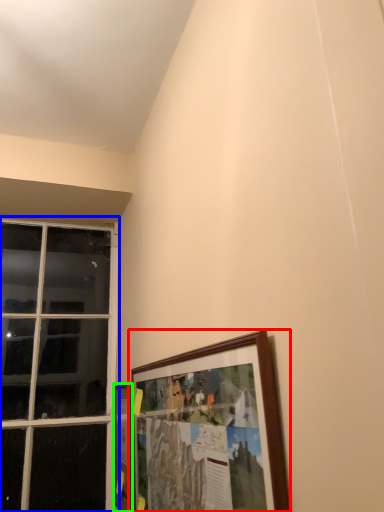
Question: Which is nearer to the picture frame (highlighted by a red box)? window (highlighted by a blue box) or picture frame (highlighted by a green box).

Choices:
 (A) window
 (B) picture frame

Answer: (B)